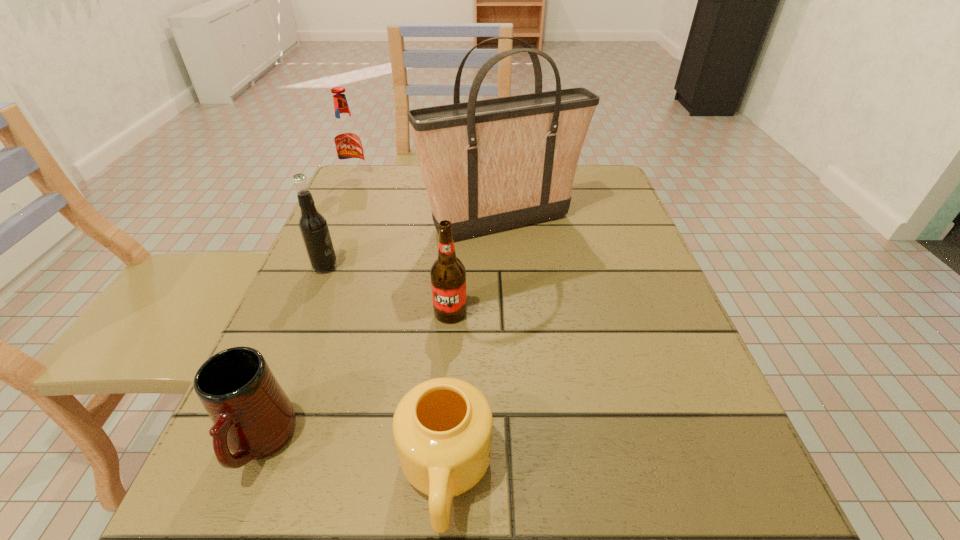
Where is `the tallest object`? Image resolution: width=960 pixels, height=540 pixels. the tallest object is located at coordinates (491, 165).

Find the location of a particular element. shopping bag is located at coordinates (491, 165).

At what (x,y) coordinates should I click in order to perform the action: click on the farthest object. Please return your answer as a coordinate pair (x, y). The image size is (960, 540). Looking at the image, I should click on (347, 137).

Identify the location of the second farthest root beer. The width and height of the screenshot is (960, 540). (313, 227).

Locate an element on the screen. The image size is (960, 540). the third nearest object is located at coordinates (448, 275).

Image resolution: width=960 pixels, height=540 pixels. I want to click on the nearest root beer, so click(x=448, y=275).

This screenshot has height=540, width=960. I want to click on the left mug, so click(253, 418).

You are a GUI agent. You are given a task and a screenshot of the screen. Output one action in this format:
    pyautogui.click(x=<x>, y=<y>)
    Task: Click on the vacant region located 0.100m on the front of the second farthest object
    
    Given the screenshot: What is the action you would take?
    pyautogui.click(x=506, y=280)

At what (x,y) coordinates should I click in order to perform the action: click on vacant space located on the right of the farthest root beer. Please return your answer as a coordinate pair (x, y). This screenshot has width=960, height=540. Looking at the image, I should click on (395, 180).

Image resolution: width=960 pixels, height=540 pixels. What are the coordinates of `blank space located 0.320m on the label of the second nearest root beer` in the screenshot? It's located at (496, 267).